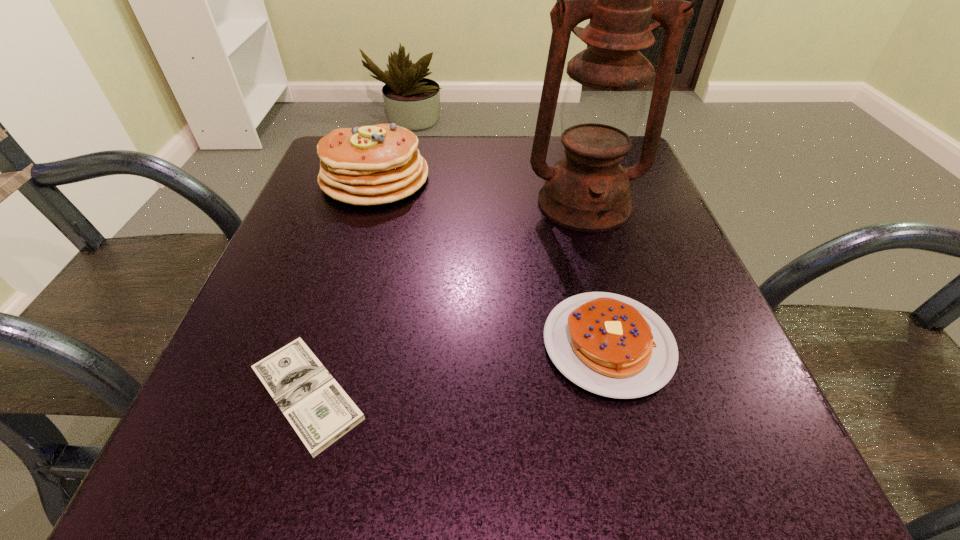
At what (x,y) coordinates should I click in order to perform the action: click on vacant space at the near edge. Please return your answer as a coordinate pair (x, y). This screenshot has width=960, height=540. Looking at the image, I should click on (495, 434).

Find the location of a particular element. This screenshot has height=540, width=960. vacant space at the left edge of the desktop is located at coordinates (221, 373).

Where is `vacant region at the right edge of the desktop`? The height and width of the screenshot is (540, 960). vacant region at the right edge of the desktop is located at coordinates (646, 196).

The height and width of the screenshot is (540, 960). What are the coordinates of `vacant space at the near left corner` in the screenshot? It's located at (238, 446).

Find the location of a particular element. Image resolution: width=960 pixels, height=540 pixels. free spot at the near right corner of the desktop is located at coordinates (748, 485).

At what (x,y) coordinates should I click in order to perform the action: click on empty location between the farther pancake and the shorter pancake. Please return your answer as a coordinate pair (x, y). Looking at the image, I should click on (492, 261).

This screenshot has height=540, width=960. I want to click on free point between the oil lamp and the shorter pancake, so click(596, 274).

The height and width of the screenshot is (540, 960). What are the coordinates of `empty space between the third tallest object and the dollar` in the screenshot? It's located at (458, 369).

Find the location of a particular element. free space between the shortest object and the shorter pancake is located at coordinates (458, 369).

Where is `free area in between the dollar and the tallest object`? Image resolution: width=960 pixels, height=540 pixels. free area in between the dollar and the tallest object is located at coordinates (445, 299).